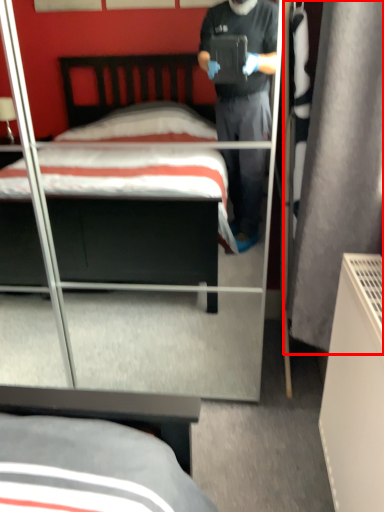
Question: Considering the relative positions of curtain (annotated by the red box) and bed in the image provided, where is curtain (annotated by the red box) located with respect to the staircase?

Choices:
 (A) right
 (B) left

Answer: (A)